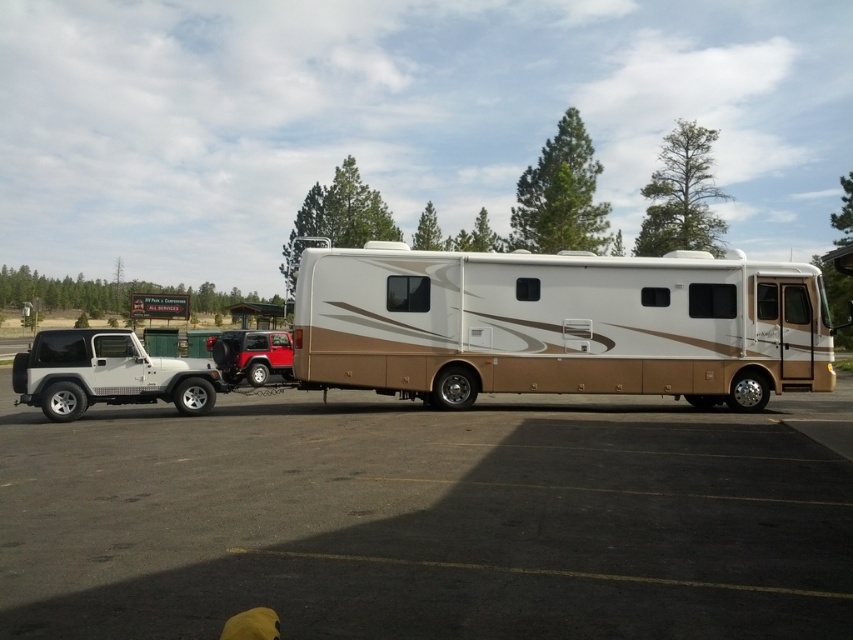
Question: Among these points, which one is farthest from the camera?

Choices:
 (A) (280, 364)
 (B) (614, 330)

Answer: (A)

Question: Which point is farther from the camera taking this photo?

Choices:
 (A) (813, 342)
 (B) (276, 372)

Answer: (B)

Question: Is matte brown rv at center positioned before metallic red suv at left?

Choices:
 (A) no
 (B) yes

Answer: (B)

Question: Does matte brown rv at center appear under metallic red suv at left?

Choices:
 (A) no
 (B) yes

Answer: (A)

Question: Is matte brown rv at center above metallic red suv at left?

Choices:
 (A) yes
 (B) no

Answer: (A)

Question: Among these objects, which one is nearest to the camera?

Choices:
 (A) metallic red suv at left
 (B) matte brown rv at center

Answer: (B)